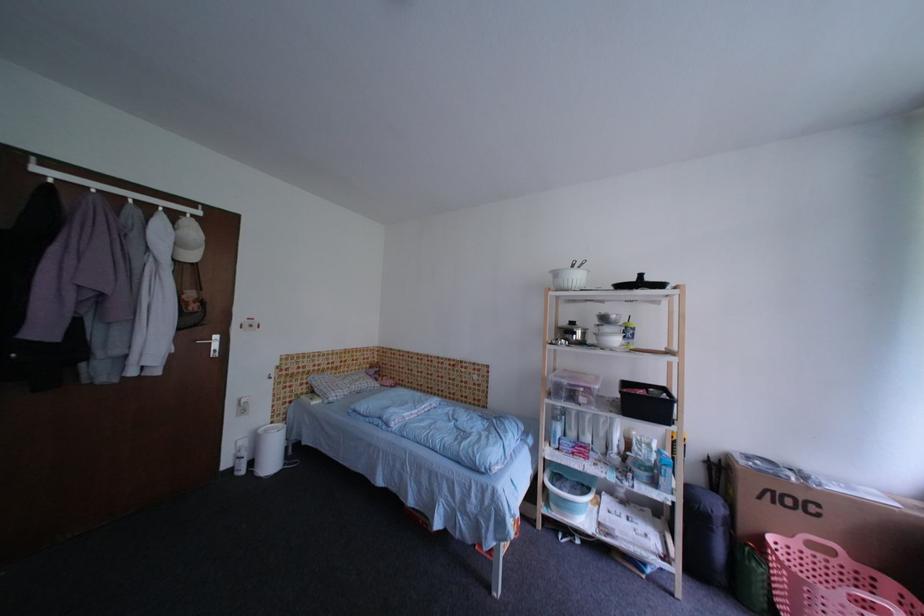
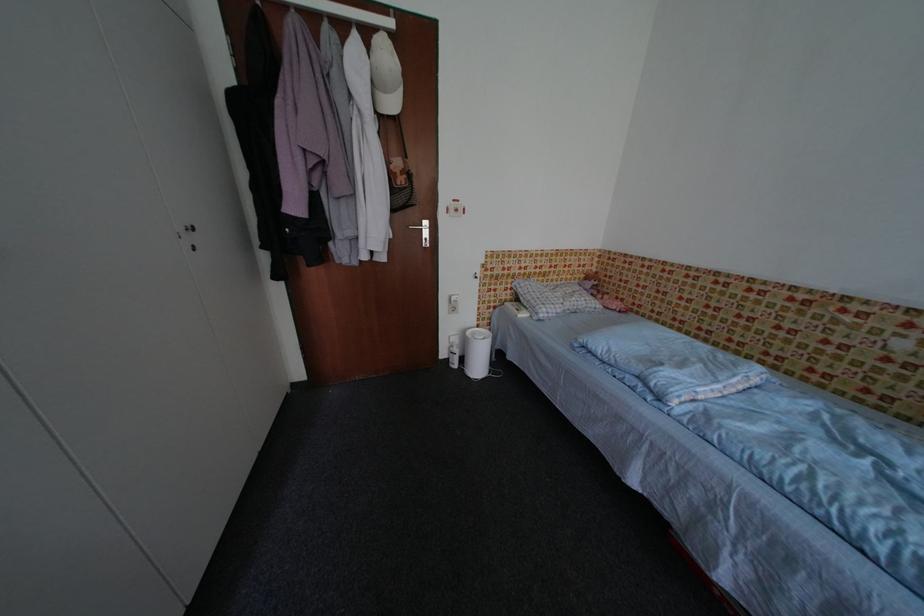
Locate, in the second image, the point that corresponds to point 238,472 in the first image.

(455, 363)